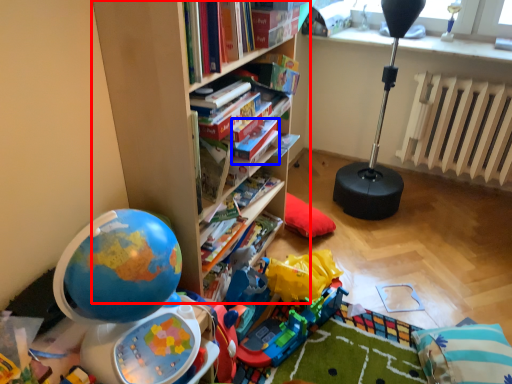
Question: Among these objects, which one is nearest to the camera, bookcase (highlighted by a red box) or paperback book (highlighted by a blue box)?

Choices:
 (A) bookcase
 (B) paperback book

Answer: (A)